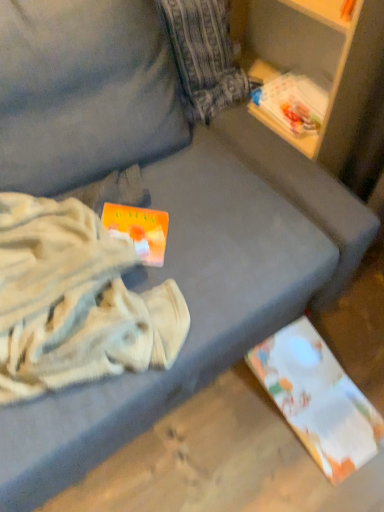
Question: From a real-world perspective, relative to white cotton blanket at left, is orange matte paperback book at center-left, acting as the 2th paperback book starting from the back, vertically above or below?

Choices:
 (A) below
 (B) above

Answer: (A)

Question: From the image's perspective, is orange matte paperback book at center-left, acting as the 1th paperback book starting from the left, above or below white cotton blanket at left?

Choices:
 (A) below
 (B) above

Answer: (B)

Question: Considering the real-world distances, which object is farthest from the white paper at lower right, acting as the first paperback book starting from the back?

Choices:
 (A) orange matte paperback book at center-left, acting as the 1th paperback book starting from the left
 (B) white cotton blanket at left

Answer: (A)

Question: Which object is positioned farthest from the white cotton blanket at left?

Choices:
 (A) orange matte paperback book at center-left, the 2th paperback book viewed from the right
 (B) white paper at lower right, marked as the first paperback book in a bottom-to-top arrangement

Answer: (B)